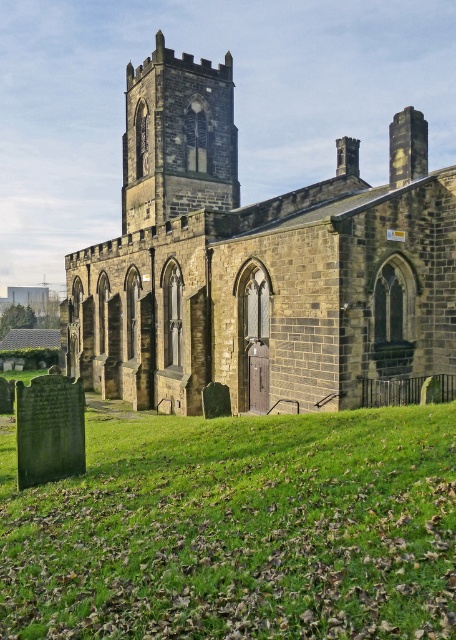
You are standing at the entrance of the historic stone church and looking towards the tall tower. There are two points marked on the ground in front of you. One is labeled as point (412, 419) and the other as point (145, 76). Which point is closer to you as you face the tower?

Point (412, 419) is closer to you because it is in front of point (145, 76).